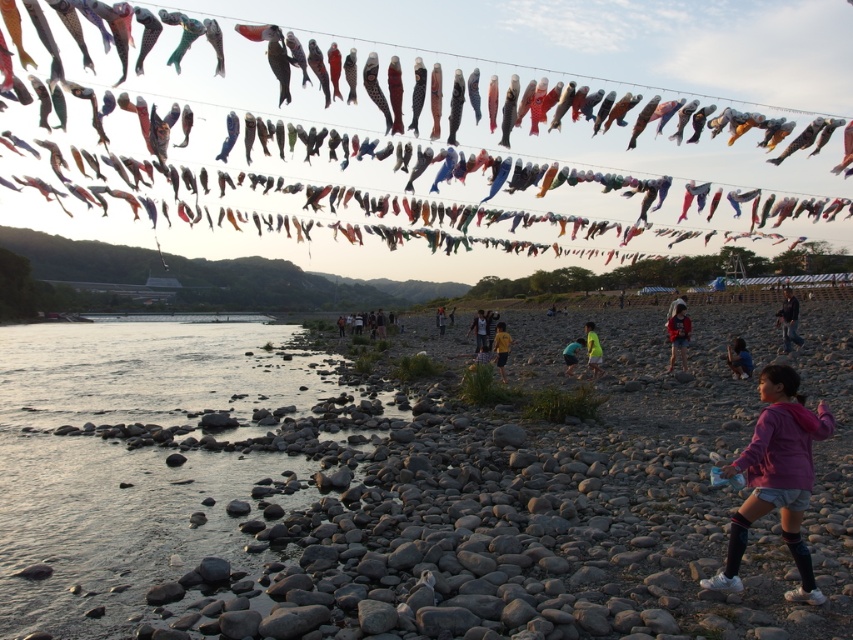
You are standing at the riverside and want to take a photo of both point (744, 538) and point (784, 291). Which point should you focus on first to ensure both are in clear view?

You should focus on point (744, 538) first because it is closer to the camera than point (784, 291), ensuring both points are in clear view.

You are standing on the riverside and see the purple fleece jacket at lower right and the dark blue jacket at lower right. Which jacket is closer to you?

The purple fleece jacket at lower right is closer to you because it is in front of the dark blue jacket at lower right.

In the scene shown: You are a photographer standing at the riverside and want to capture both the pink fabric at center and the dark blue shirt at center in a single photo. Which object should you focus on first to ensure both are in clear view?

The pink fabric at center is in front of the dark blue shirt at center, so you should focus on the pink fabric at center first to ensure both are in clear view.